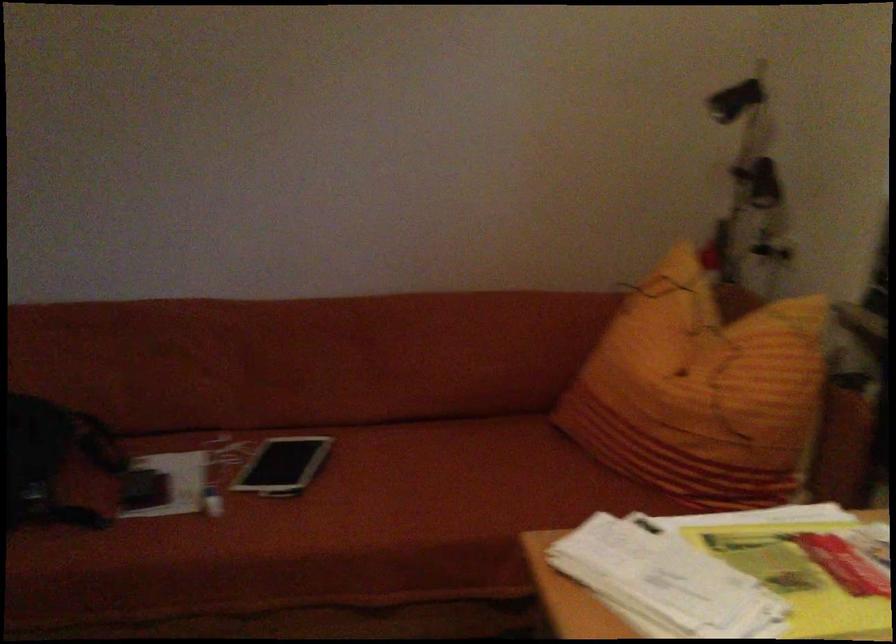
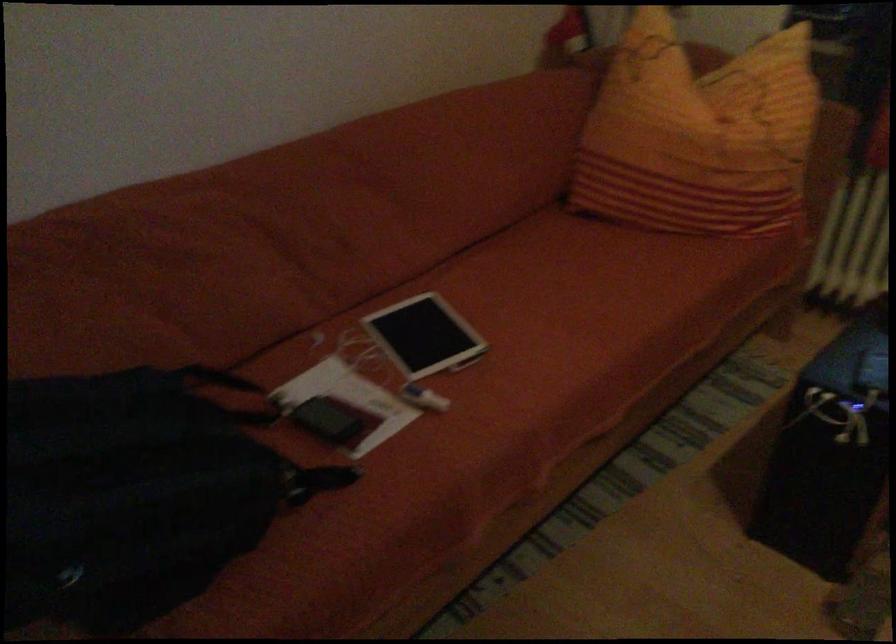
In the second image, find the point that corresponds to (x=168, y=482) in the first image.

(350, 401)